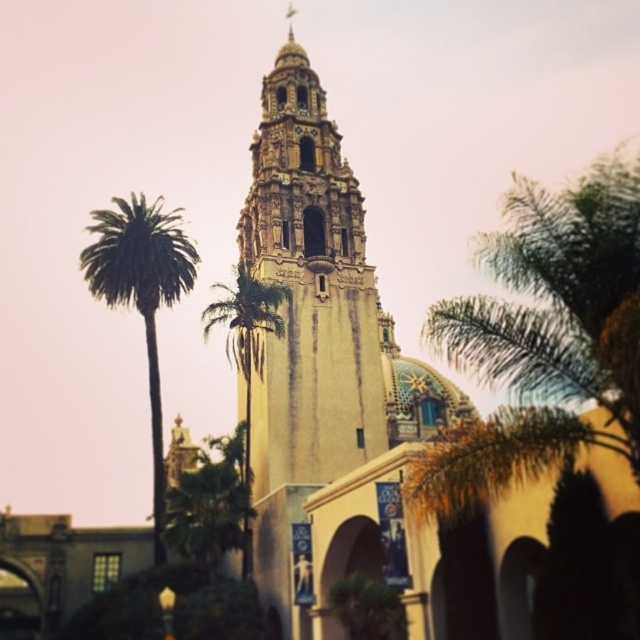
Can you confirm if beige stone bell tower at center is taller than green leafy palm tree at left?

Yes, beige stone bell tower at center is taller than green leafy palm tree at left.

Is point (324, 356) positioned behind point (109, 282)?

That is False.

Find the location of a particular element. This screenshot has height=640, width=640. beige stone bell tower at center is located at coordinates (308, 289).

Between beige stone bell tower at center and green leafy palm tree at center, which one has less height?

green leafy palm tree at center is shorter.

Does beige stone bell tower at center have a smaller size compared to green leafy palm tree at center?

Actually, beige stone bell tower at center might be larger than green leafy palm tree at center.

Is point (336, 273) positioned in front of point (244, 280)?

No, it is not.

Where is `beige stone bell tower at center`? Image resolution: width=640 pixels, height=640 pixels. beige stone bell tower at center is located at coordinates tap(308, 289).

Which is in front, point (152, 228) or point (243, 472)?

Point (243, 472) is in front.

This screenshot has height=640, width=640. I want to click on green leafy palm tree at left, so click(x=141, y=292).

This screenshot has height=640, width=640. Identify the location of green leafy palm tree at left. (141, 292).